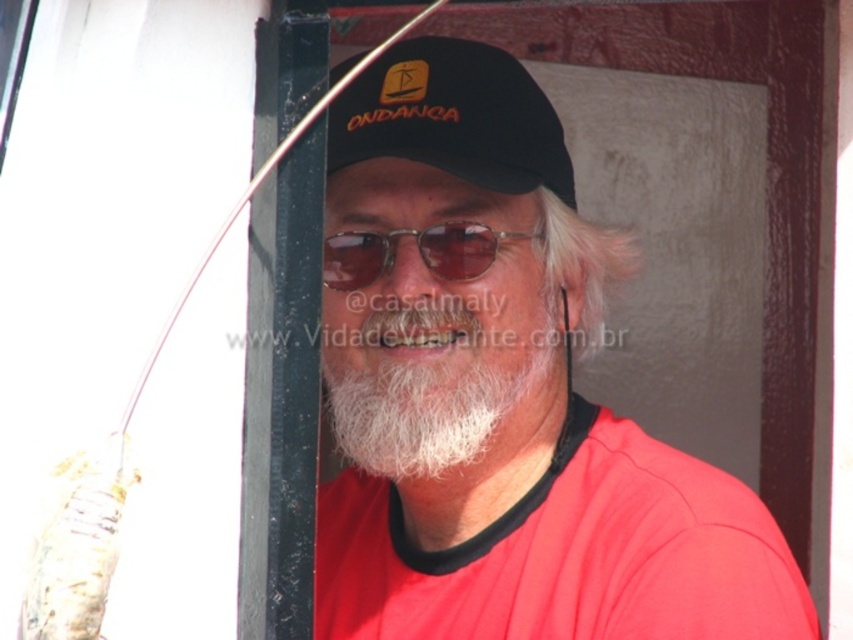
You are a photographer trying to capture the perfect shot of the matte black cap at center. The cap is positioned at coordinates point 0.613, 0.587. If your camera has a focal length of 50mm and you want to ensure the cap fills the frame vertically, what adjustment should you make to your camera settings?

To ensure the matte black cap at center fills the frame vertically, you should adjust your camera to a shorter focal length than 50mm since the cap is positioned at point (500, 392), which might require a wider angle to encompass it fully.

You are a photographer trying to capture a portrait of the person in the image. You notice the black matte baseball cap at center and the white soft beard at center. Which object is narrower when viewed from your camera position?

The black matte baseball cap at center has a lesser width compared to the white soft beard at center, so the black matte baseball cap at center is narrower.